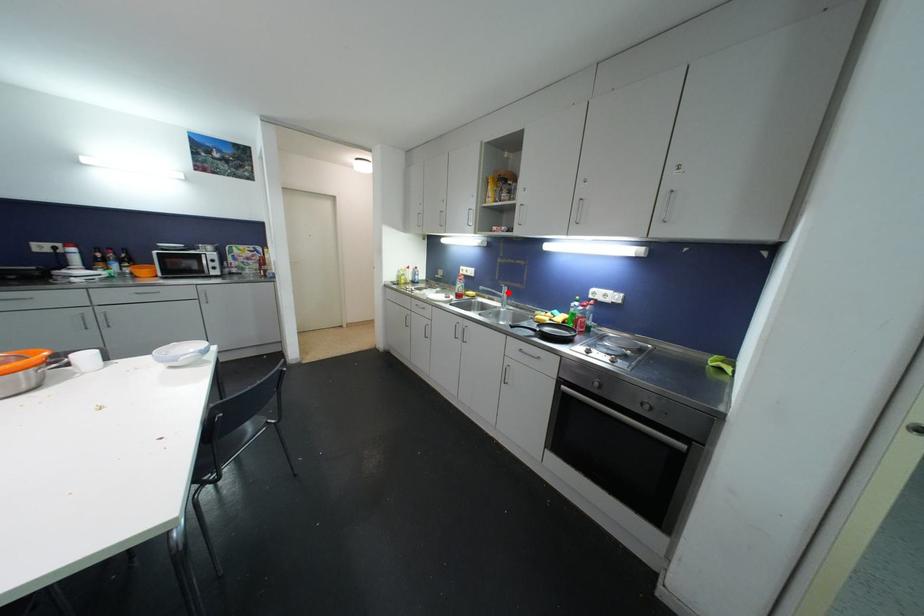
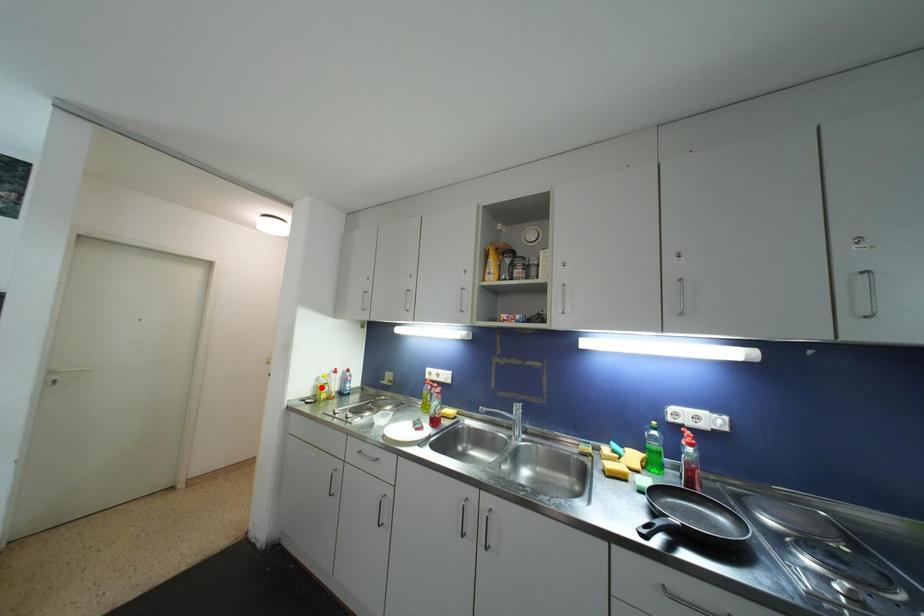
I am providing you with two images of the same scene from different viewpoints. A red point is marked on the first image and another point is marked on the second image. Is the red point in image1 aligned with the point shown in image2?

No